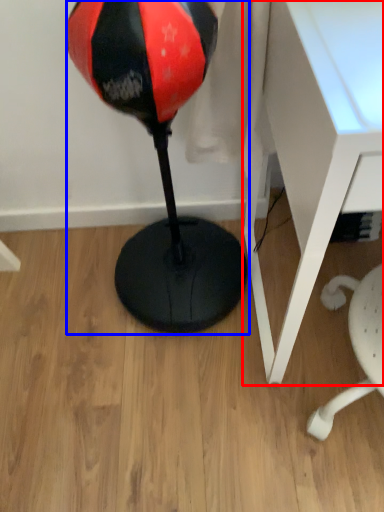
Question: Which object is closer to the camera taking this photo, table (highlighted by a red box) or bean bag chair (highlighted by a blue box)?

Choices:
 (A) table
 (B) bean bag chair

Answer: (A)